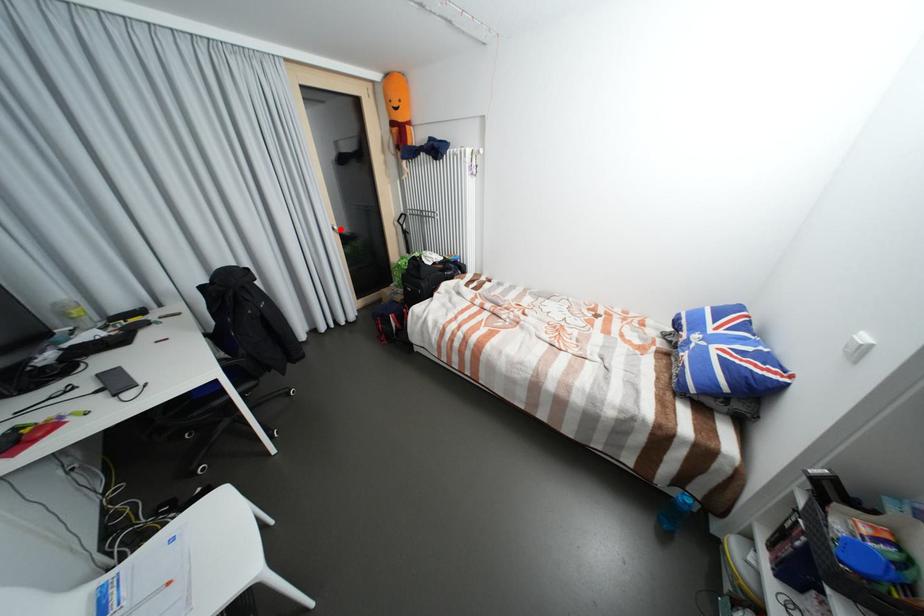
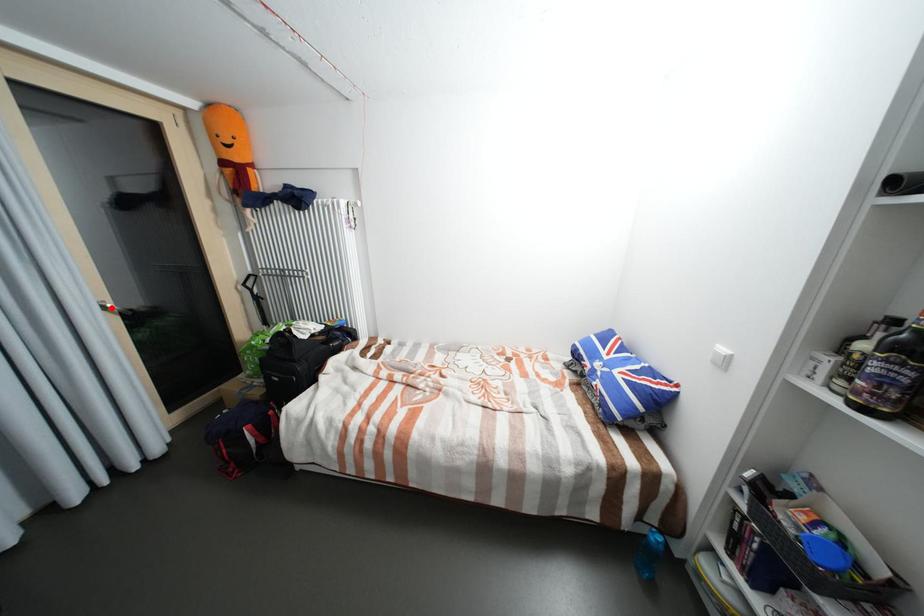
I am providing you with two images of the same scene from different viewpoints. A red point is marked on the first image and another point is marked on the second image. Is the marked point in image1 the same physical position as the marked point in image2?

Yes